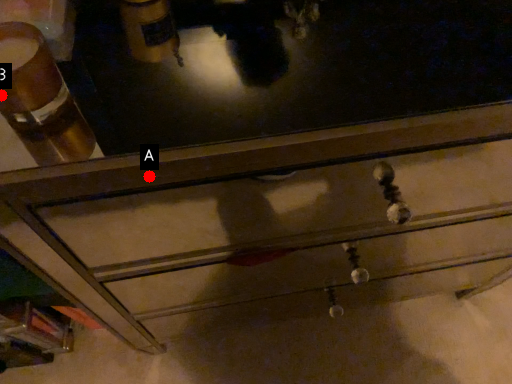
Question: Two points are circled on the image, labeled by A and B beside each circle. Which point is closer to the camera taking this photo?

Choices:
 (A) A is closer
 (B) B is closer

Answer: (B)